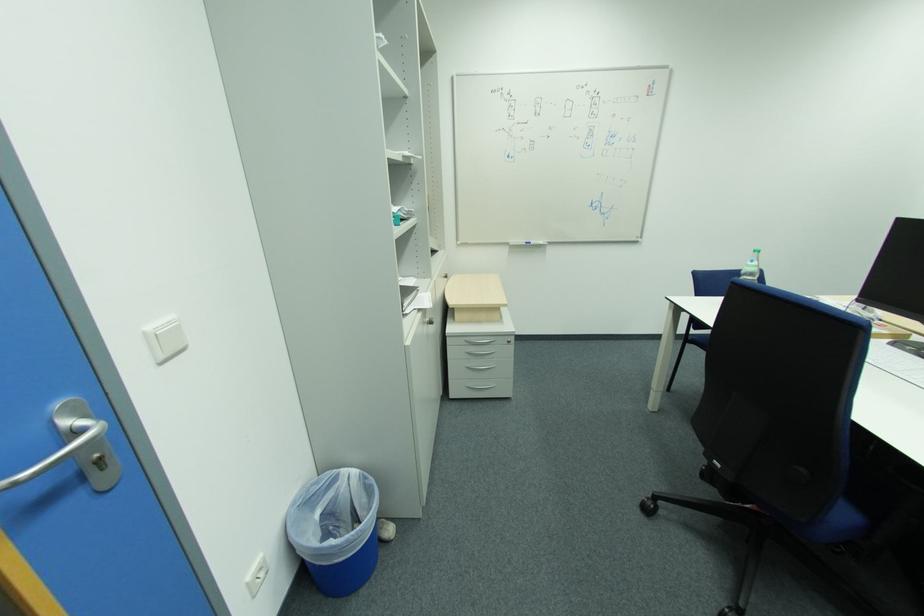
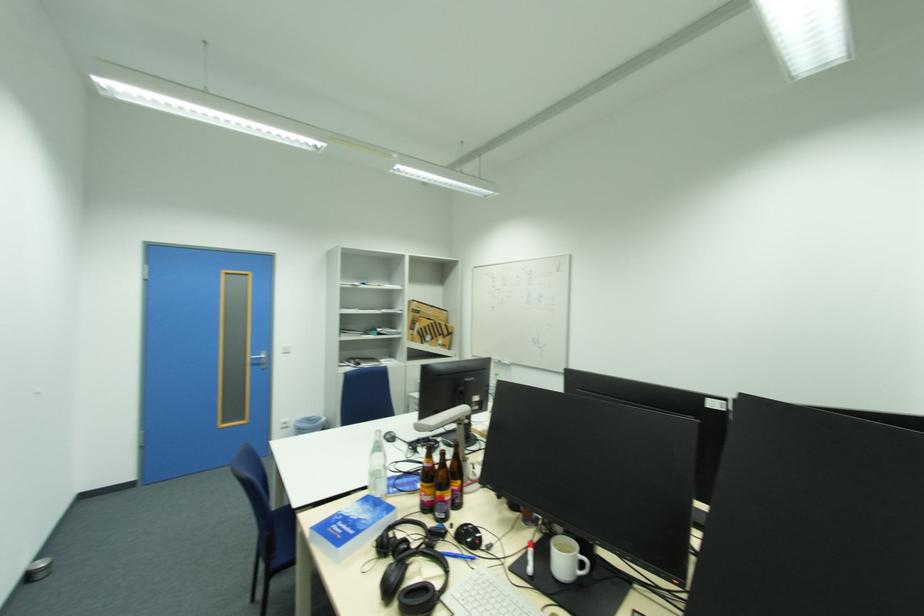
In the second image, find the point that corresponds to [154,329] in the first image.

(289, 347)